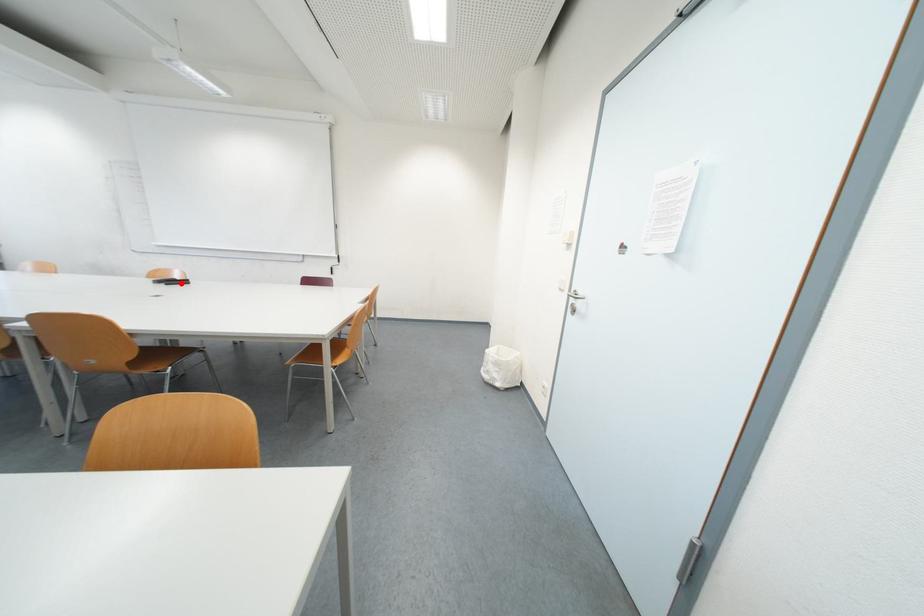
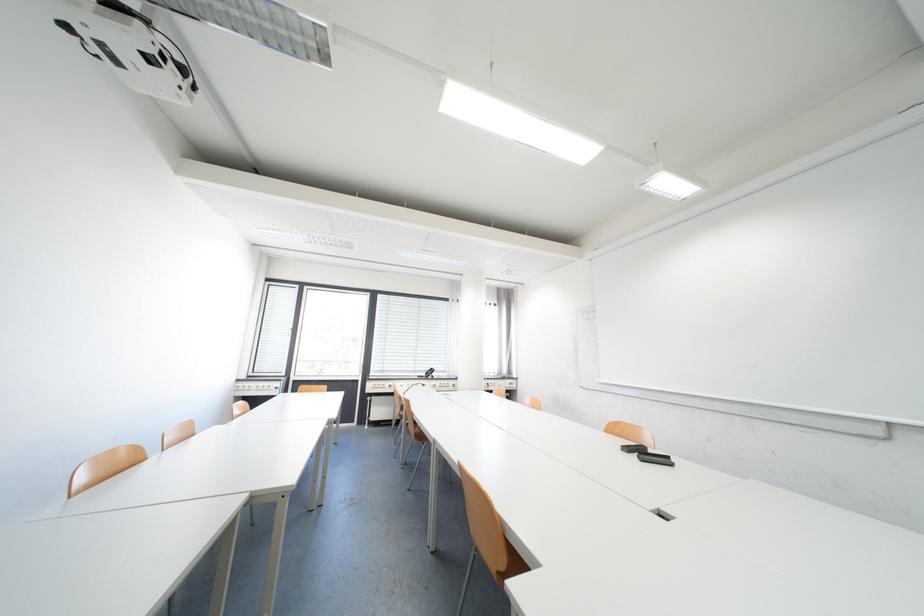
Locate, in the second image, the point that corresponds to the highlighted location in the first image.

(652, 454)